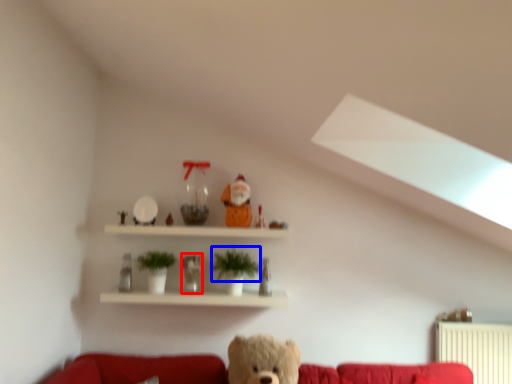
Question: Which of the following is the farthest to the observer, figurine (highlighted by a red box) or plant (highlighted by a blue box)?

Choices:
 (A) figurine
 (B) plant

Answer: (A)